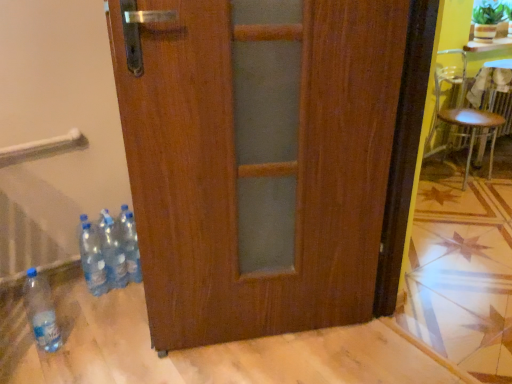
This screenshot has width=512, height=384. Find the location of `space that is in front of transparent plastic bottles at lower left, marked as the third bottle in a right-to-left arrangement`. space that is in front of transparent plastic bottles at lower left, marked as the third bottle in a right-to-left arrangement is located at coordinates (88, 314).